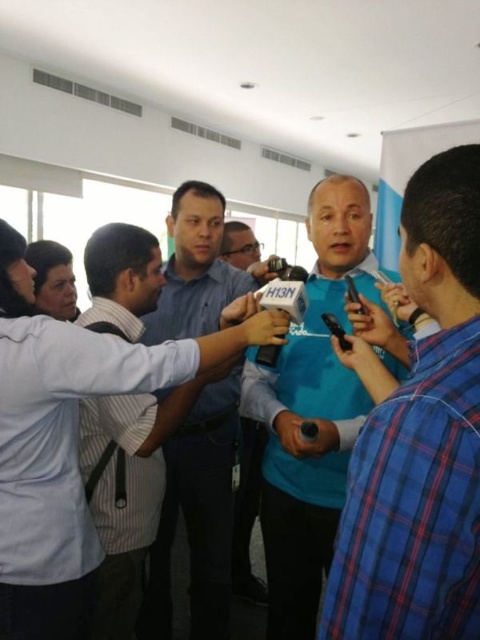
You are standing at the point labeled as point (187, 225) in a conference room. You want to move to the nearest exit, which is located 10 feet away from your current position. Can you reach the exit without moving more than 10 feet?

The point labeled (187, 225) is 6.15 feet away from the viewer. Since the exit is 10 feet away, you can reach it without moving more than 10 feet.

You are a photographer in the room and need to capture a closeup shot of the light blue shirt at center and the blue fabric shirt at center. Can you fit both in the frame if your camera has a minimum focus distance of 16 inches?

The light blue shirt at center and blue fabric shirt at center are 16.10 inches apart from each other, so the camera with a minimum focus distance of 16 inches can just barely fit both in the frame since the distance is slightly over the minimum requirement.